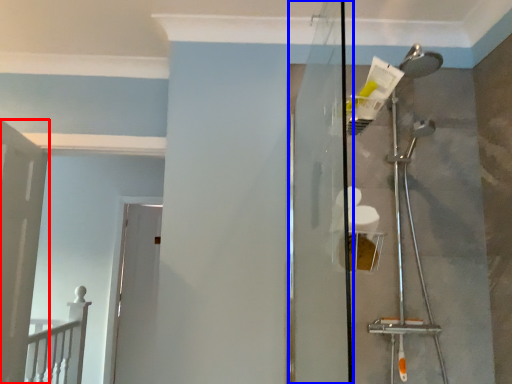
Question: Which of the following is the farthest to the observer, door (highlighted by a red box) or screen door (highlighted by a blue box)?

Choices:
 (A) door
 (B) screen door

Answer: (A)